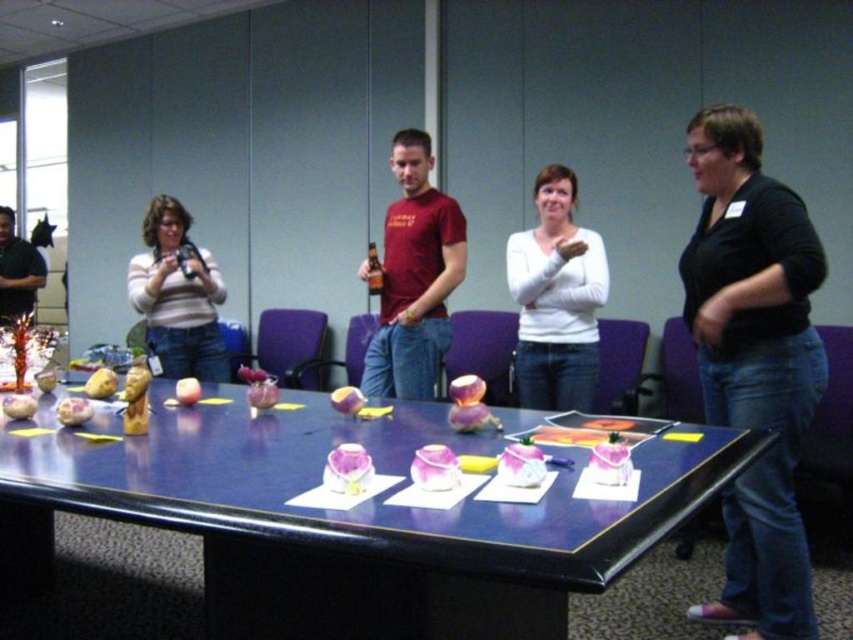
Between black matte shirt at center and red matte apple at center, which one has less height?

With less height is red matte apple at center.

Does black matte shirt at center appear on the right side of red matte apple at center?

Indeed, black matte shirt at center is positioned on the right side of red matte apple at center.

Between point (715, 612) and point (344, 406), which one is positioned in front?

Point (344, 406)

Locate an element on the screen. This screenshot has width=853, height=640. black matte shirt at center is located at coordinates click(753, 362).

Between brushed metal water at bottle left and shiny red apple at center, which one is positioned lower?

shiny red apple at center is below.

Based on the photo, is brushed metal water at bottle left in front of shiny red apple at center?

No, it is not.

In order to click on brushed metal water at bottle left in this screenshot , I will do `click(16, 269)`.

The image size is (853, 640). I want to click on brushed metal water at bottle left, so [16, 269].

Does matte red t-shirt at center have a greater height compared to red matte apple at center?

Yes, matte red t-shirt at center is taller than red matte apple at center.

What do you see at coordinates (415, 276) in the screenshot? I see `matte red t-shirt at center` at bounding box center [415, 276].

Between point (416, 314) and point (334, 392), which one is positioned behind?

Point (334, 392)

Where is `matte red t-shirt at center`? This screenshot has height=640, width=853. matte red t-shirt at center is located at coordinates (415, 276).